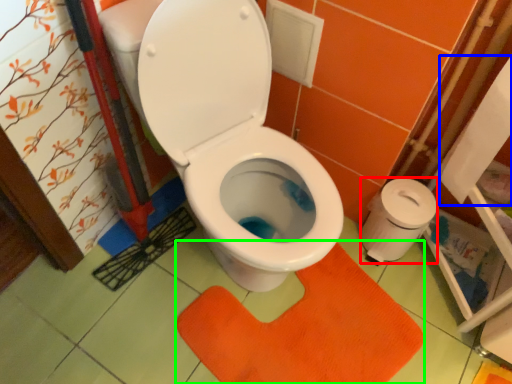
Question: Which object is positioned farthest from toilet paper (highlighted by a red box)? Select from toilet paper (highlighted by a blue box) and doormat (highlighted by a green box).

Choices:
 (A) toilet paper
 (B) doormat

Answer: (B)